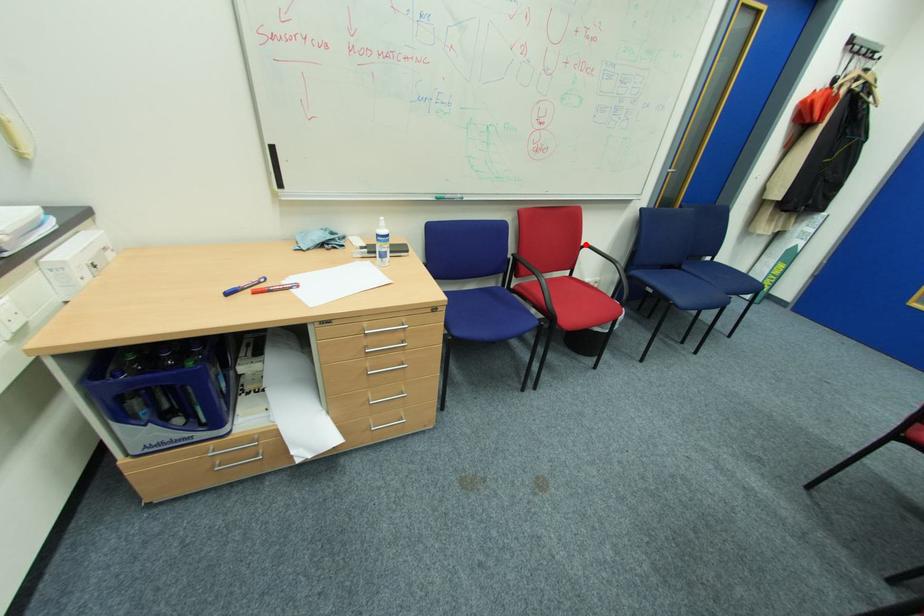
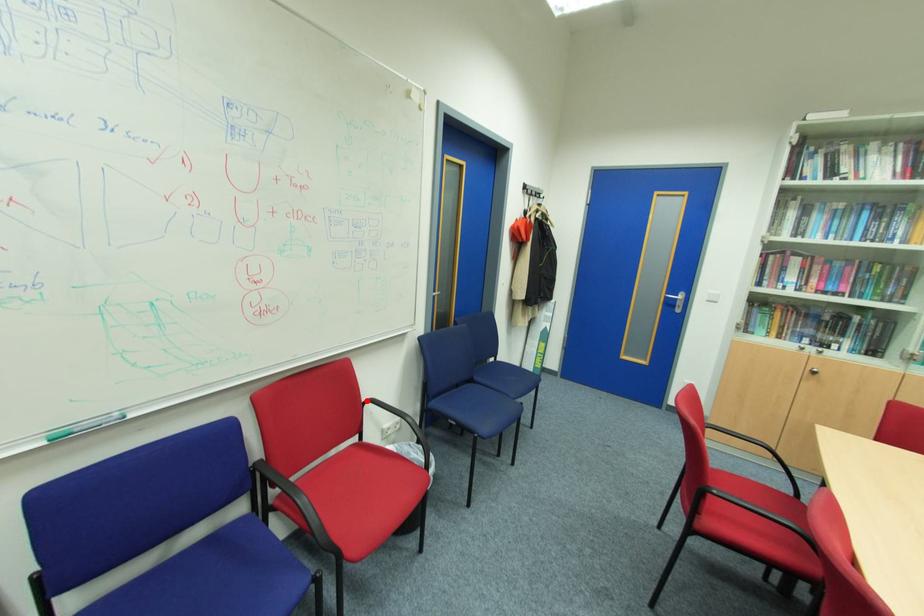
I am providing you with two images of the same scene from different viewpoints. A red point is marked on the first image and another point is marked on the second image. Do the highlighted points in image1 and image2 indicate the same real-world spot?

Yes